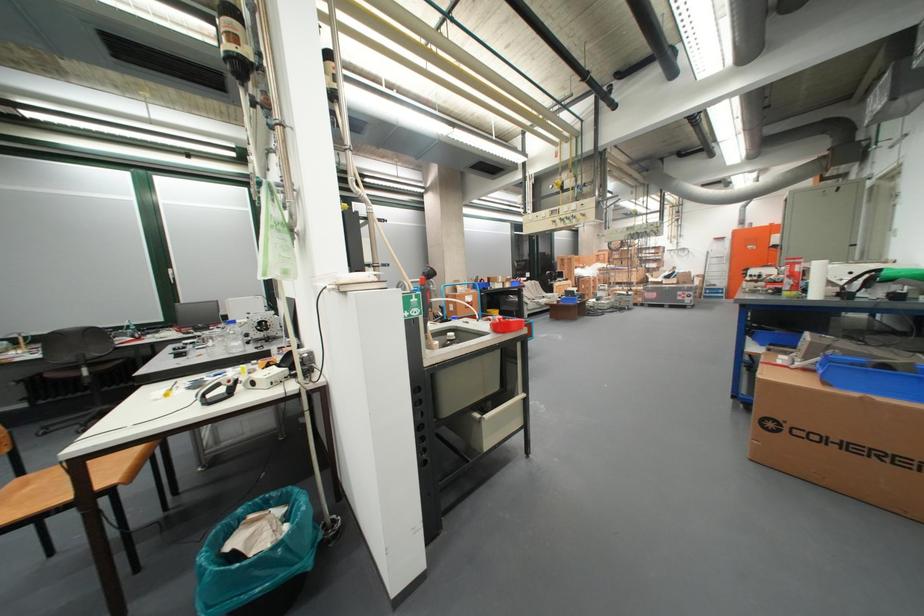
What do you see at coordinates (78, 369) in the screenshot? This screenshot has height=616, width=924. I see `the black chair sitting surface` at bounding box center [78, 369].